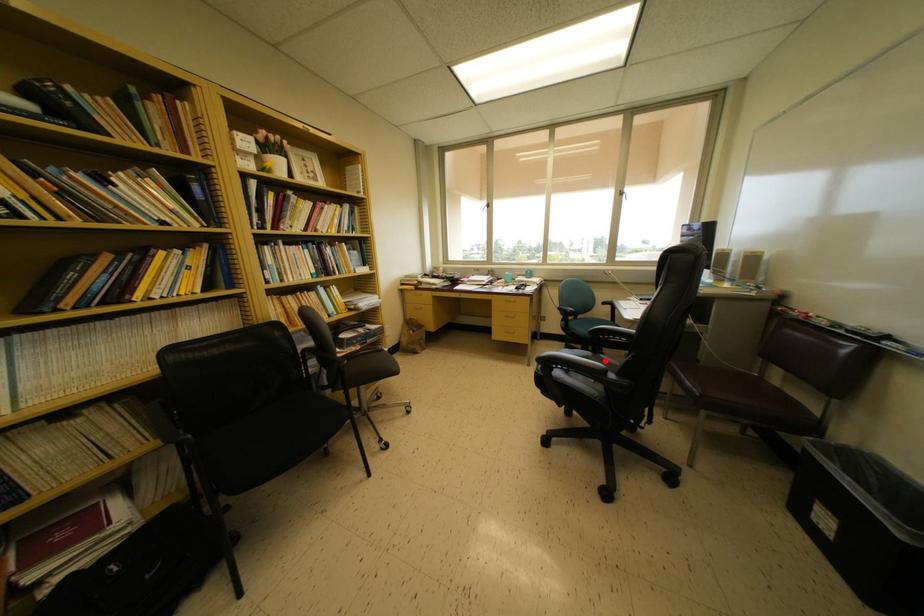
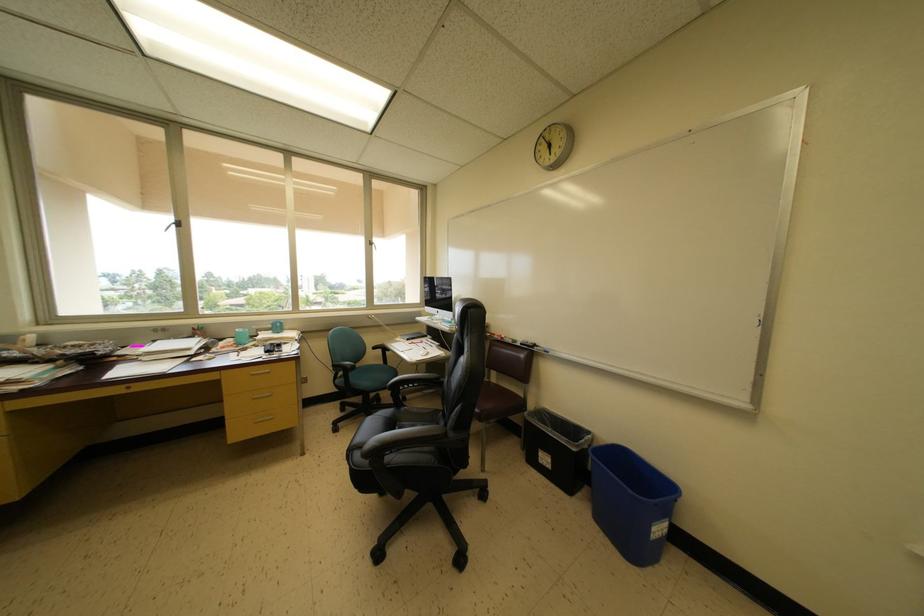
Question: I am providing you with two images of the same scene from different viewpoints. Image1 has a red point marked. In image2, the corresponding 3D location appears at what relative position? Reply with the corresponding letter.

Choices:
 (A) Closer
 (B) Farther

Answer: (B)